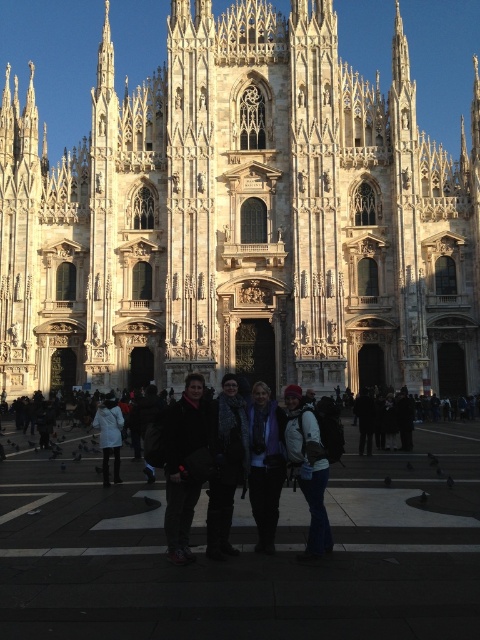
You are a photographer planning to capture a group photo of the tourists in front of the cathedral. Considering the dark gray sweater at center and the white matte jacket at center, which clothing item appears narrower when viewed from your camera position?

The dark gray sweater at center has a lesser width compared to the white matte jacket at center, so the dark gray sweater at center appears narrower.

You are a tour guide planning to take a group photo of the tourists wearing the dark gray sweater at center and the denim jacket at center. The photographer needs to know if they can stand side by side within a 15 feet distance for the perfect shot. Can they?

The dark gray sweater at center and denim jacket at center are 12.37 feet apart from each other, so yes, they can stand side by side within the 15 feet distance required for the perfect shot.